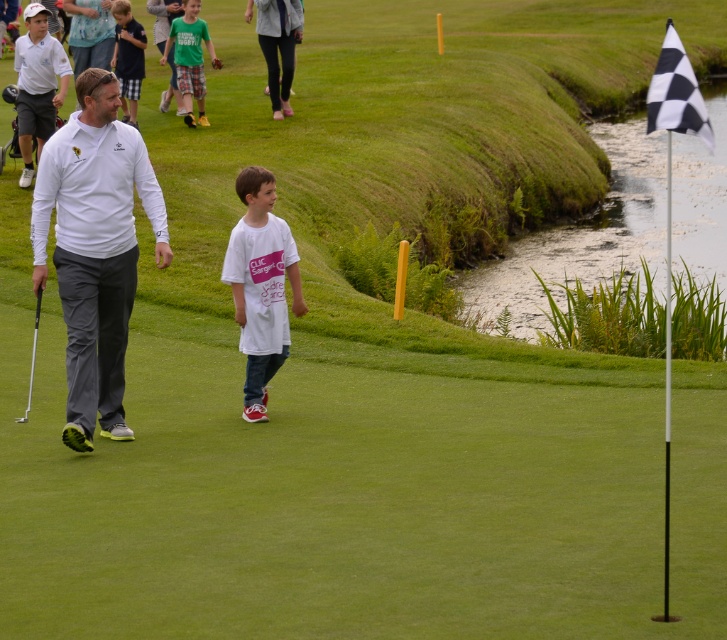
You are a photographer standing at the back of the golf course. You notice the green plaid shorts at upper center and the metallic silver golf club at left. Which object is wider?

The green plaid shorts at upper center is wider than the metallic silver golf club at left.

You are standing at the point labeled point (193, 13) and want to walk towards the point labeled point (145, 44). According to the scene, will you be moving forward or backward relative to the camera?

Since point (193, 13) is behind point (145, 44), moving from point (193, 13) to point (145, 44) means you are moving forward towards the camera.

You are a golfer standing at the point labeled as point (95, 248). You want to hit a ball to the hole located at the center of the green. Is the golf club at your current position suitable for this shot?

The point (95, 248) corresponds to the white matte golf club at center, so yes, the golf club at your current position is suitable for hitting the ball to the hole located at the center of the green.